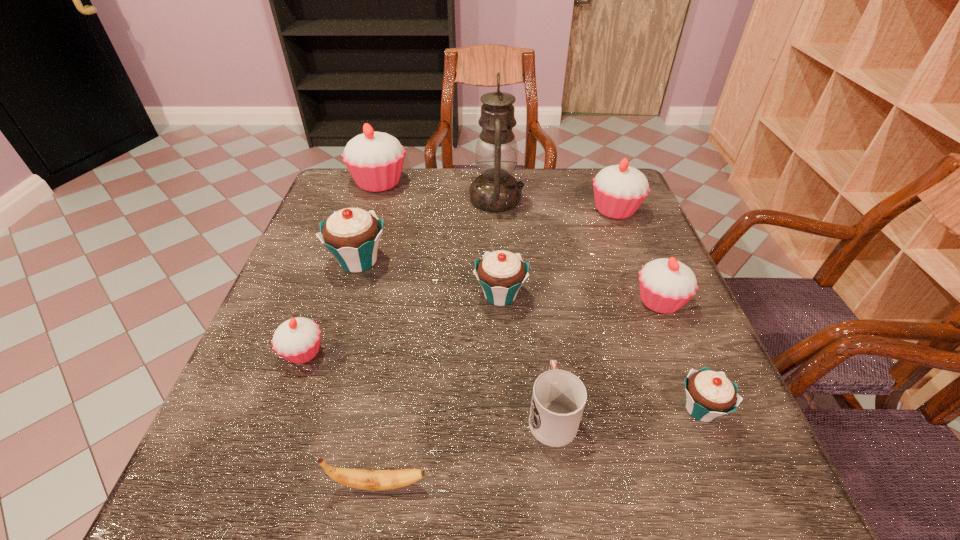
At what (x,y) coordinates should I click in order to perform the action: click on vacant space located on the front of the fourth cupcake from left to right. Please return your answer as a coordinate pair (x, y). Looking at the image, I should click on (503, 346).

Identify the location of free region located 0.140m on the side of the red cup where the handle is located. (540, 325).

This screenshot has height=540, width=960. I want to click on free region located on the side of the red cup where the handle is located, so click(x=539, y=314).

I want to click on vacant space positioned on the side of the red cup where the handle is located, so click(x=542, y=345).

What are the coordinates of `vacant space located on the left of the seventh farthest object` in the screenshot? It's located at (249, 353).

You are a GUI agent. You are given a task and a screenshot of the screen. Output one action in this format:
    pyautogui.click(x=<x>, y=<y>)
    Task: Click on the vacant point located on the back of the rightmost teal cupcake
    The height and width of the screenshot is (540, 960).
    Given the screenshot: What is the action you would take?
    pyautogui.click(x=661, y=312)

Locate an element on the screen. The image size is (960, 540). free space located on the peel of the banana from the top is located at coordinates 586,484.

The image size is (960, 540). What are the coordinates of `oil lamp located in the far edge section of the desktop` in the screenshot? It's located at coord(496,153).

Image resolution: width=960 pixels, height=540 pixels. Find the location of `object located in the near edge section of the desktop`. object located in the near edge section of the desktop is located at coordinates (356, 478).

You are a GUI agent. You are given a task and a screenshot of the screen. Output one action in this format:
    pyautogui.click(x=<x>, y=<y>)
    Task: Click on the object at the far left corner
    The width and height of the screenshot is (960, 540).
    Given the screenshot: What is the action you would take?
    pyautogui.click(x=375, y=160)